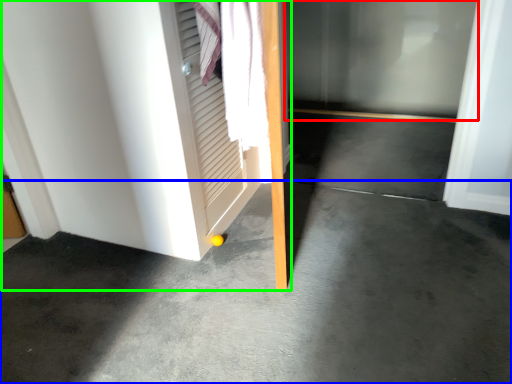
Question: Which is farther away from glass door (highlighted by a red box)? concrete (highlighted by a blue box) or door (highlighted by a green box)?

Choices:
 (A) concrete
 (B) door

Answer: (A)